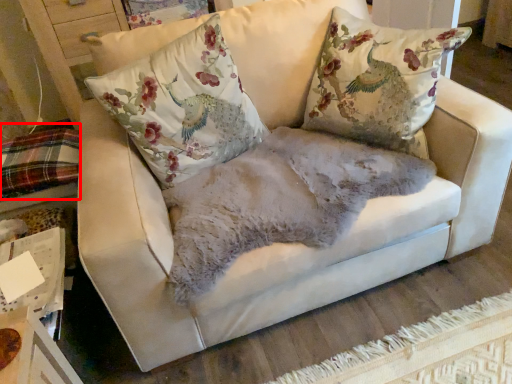
Question: From the image's perspective, what is the correct spatial positioning of bedding (annotated by the red box) in reference to pillow?

Choices:
 (A) below
 (B) above

Answer: (A)